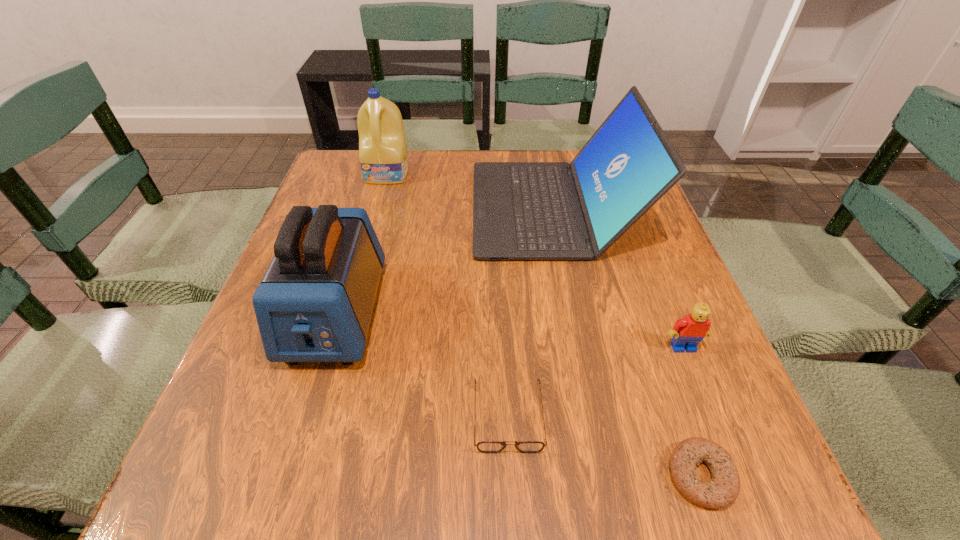
Locate an element on the screen. laptop computer is located at coordinates (521, 210).

Where is `detergent`? The width and height of the screenshot is (960, 540). detergent is located at coordinates (383, 157).

The width and height of the screenshot is (960, 540). Identify the location of toaster. (314, 304).

I want to click on the third shortest object, so click(688, 331).

This screenshot has height=540, width=960. What are the coordinates of `sunglasses` in the screenshot? It's located at pyautogui.click(x=485, y=446).

This screenshot has width=960, height=540. I want to click on the shortest object, so click(x=721, y=491).

You are a GUI agent. You are given a task and a screenshot of the screen. Output one action in this format:
    pyautogui.click(x=<x>, y=<y>)
    Task: Click on the vacant space situated on the screen of the laptop computer
    
    Given the screenshot: What is the action you would take?
    pyautogui.click(x=413, y=208)

Locate an element on the screen. This screenshot has width=960, height=540. free location located 0.080m on the screen of the laptop computer is located at coordinates (442, 208).

Where is `free space located on the screen of the laptop computer`? free space located on the screen of the laptop computer is located at coordinates (337, 208).

Identify the location of free region located on the label of the detergent. The width and height of the screenshot is (960, 540). (372, 231).